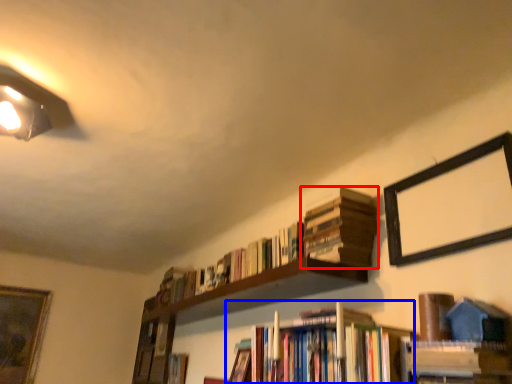
Question: Which of the following is the closest to the observer, book (highlighted by a red box) or book (highlighted by a blue box)?

Choices:
 (A) book
 (B) book

Answer: (B)